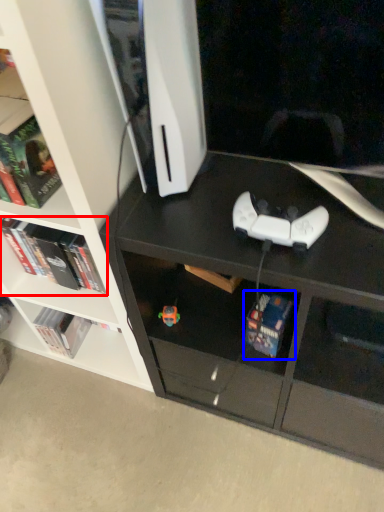
Question: Which object is further to the camera taking this photo, book (highlighted by a red box) or book (highlighted by a blue box)?

Choices:
 (A) book
 (B) book

Answer: (A)